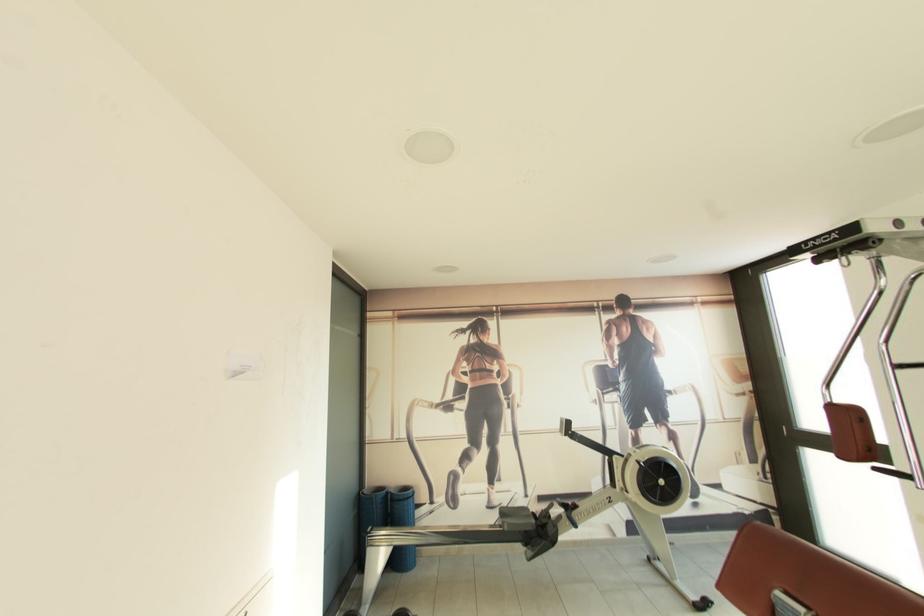
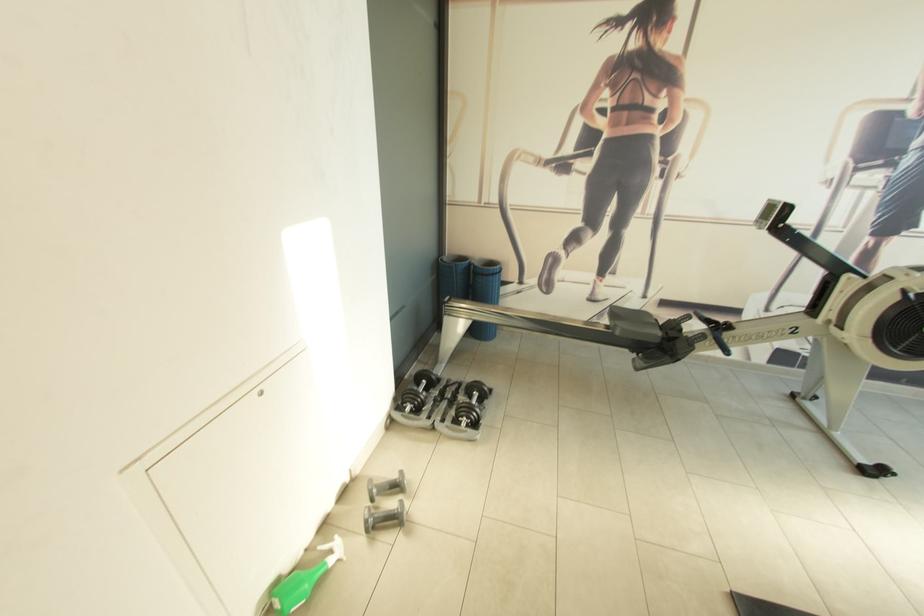
In the second image, find the point that corresponds to the point at 574,424 in the first image.

(792, 209)